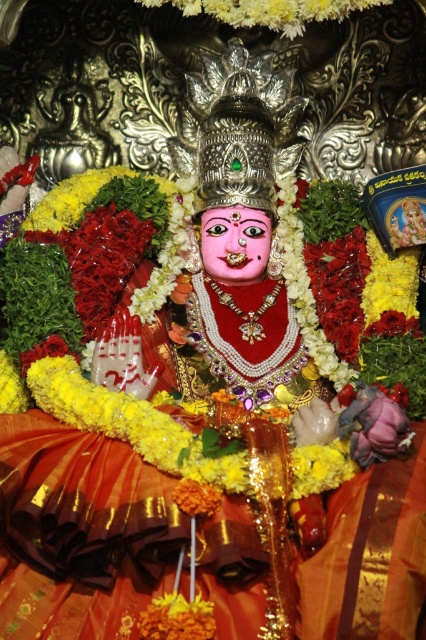
How distant is yellow fabric at upper center from yellow fabric flower at lower right?

42.52 meters

Who is lower down, yellow fabric at upper center or yellow fabric flower at lower right?

yellow fabric flower at lower right is lower down.

Identify the location of yellow fabric at upper center. This screenshot has height=640, width=426. (270, 10).